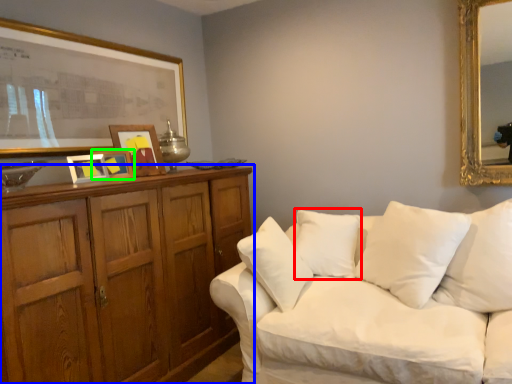
Question: Considering the real-world distances, which object is closest to pillow (highlighted by a red box)? cabinetry (highlighted by a blue box) or picture frame (highlighted by a green box).

Choices:
 (A) cabinetry
 (B) picture frame

Answer: (A)